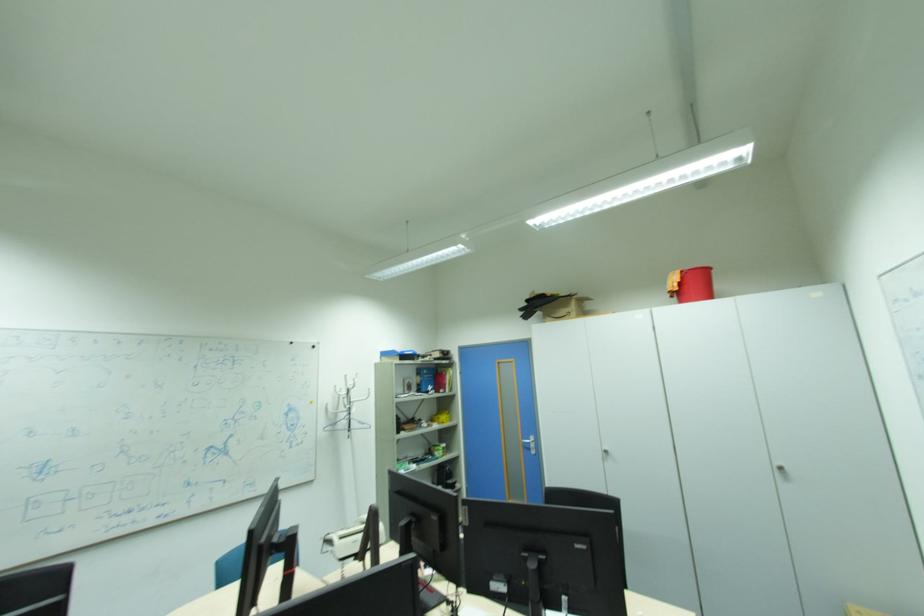
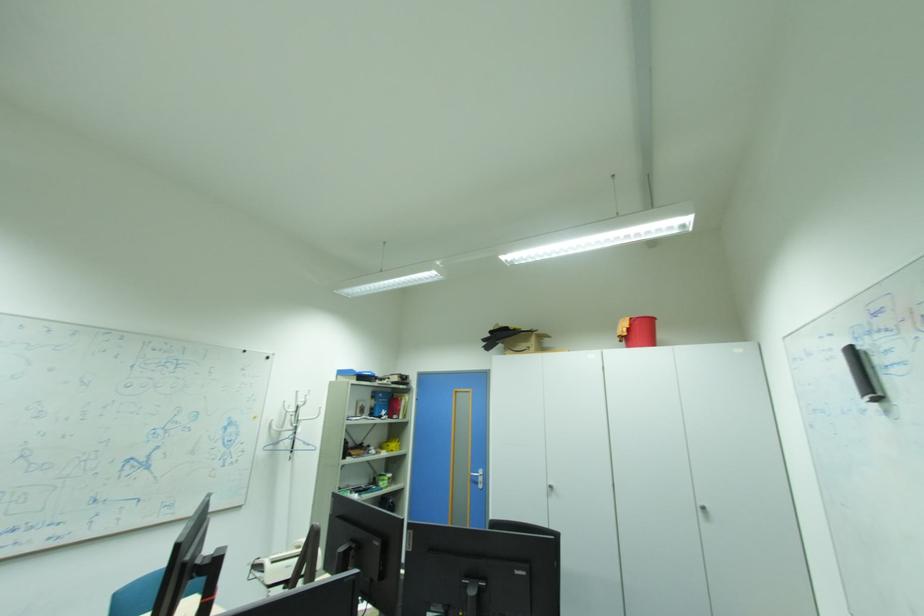
Question: The camera is either moving clockwise (left) or counter-clockwise (right) around the object. The first image is from the beginning of the video and the second image is from the end. Is the camera moving left or right when shooting the video?

Choices:
 (A) Left
 (B) Right

Answer: (A)